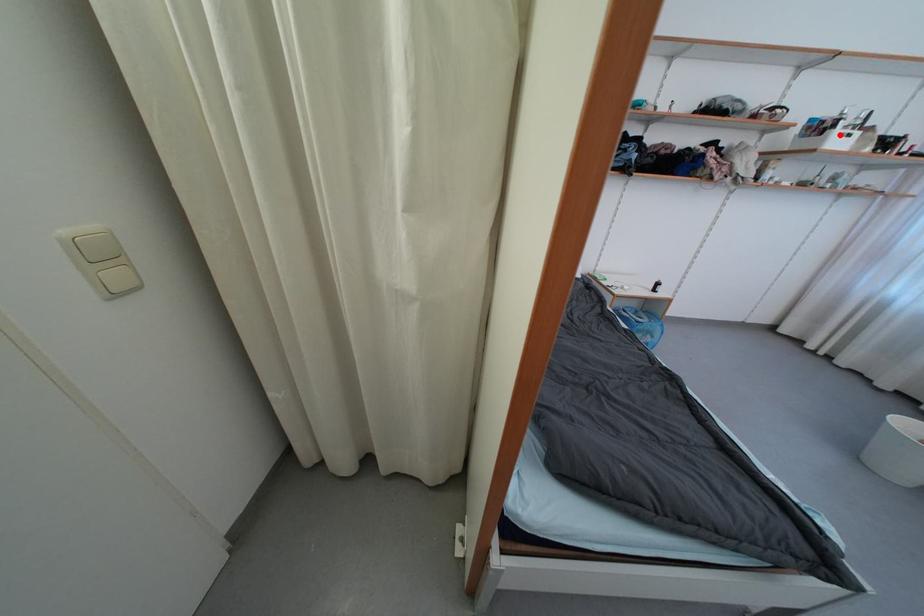
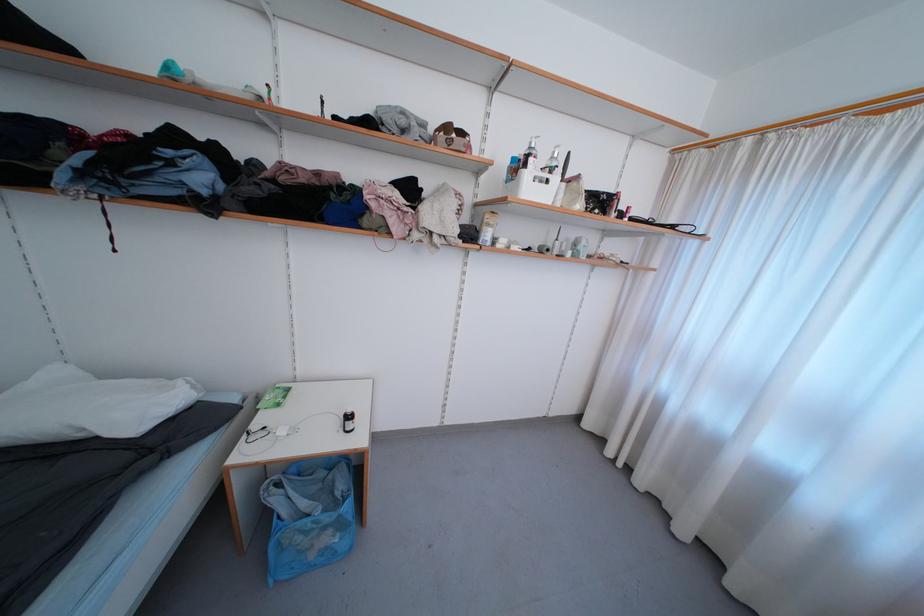
Locate, in the second image, the point that corresponds to the highlighted location in the first image.

(531, 177)